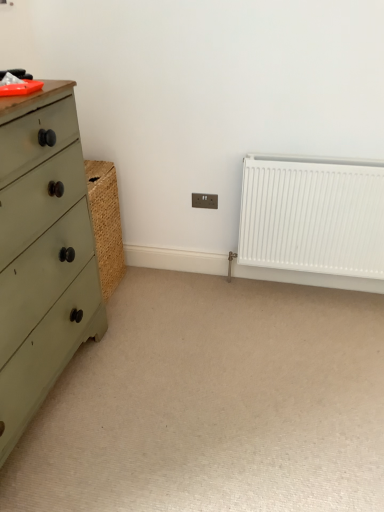
Where is `free point in front of white matte radiator at right`? This screenshot has width=384, height=512. free point in front of white matte radiator at right is located at coordinates (314, 339).